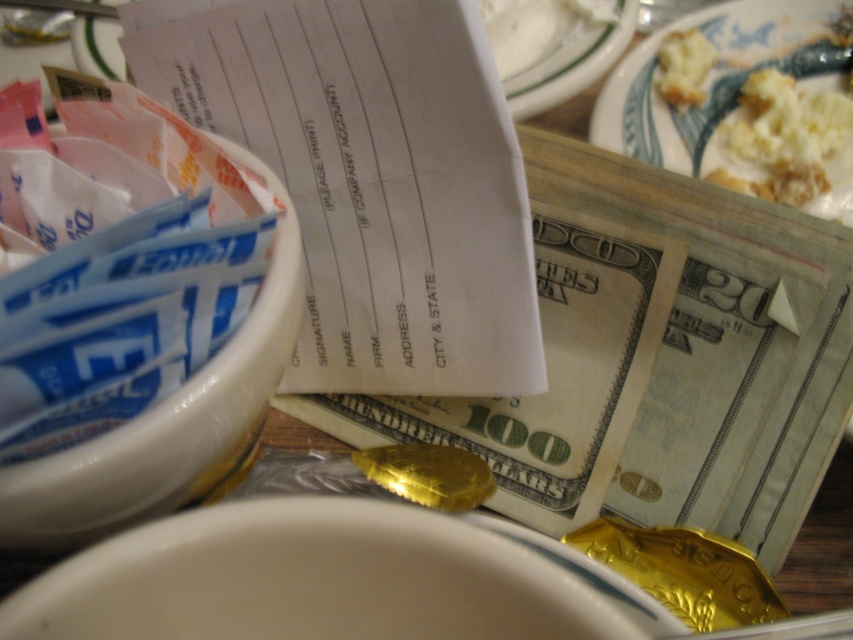
Question: Which point is closer to the camera?

Choices:
 (A) (289, 204)
 (B) (519, 48)

Answer: (A)

Question: Can you confirm if white paper receipt at center is smaller than white glossy bowl at lower center?

Choices:
 (A) no
 (B) yes

Answer: (A)

Question: Does white paper receipt at center lie behind white glossy bowl at lower center?

Choices:
 (A) yes
 (B) no

Answer: (A)

Question: Which object is positioned farthest from the white fluffy mashed potato at upper right?

Choices:
 (A) white paper receipt at center
 (B) golden crumbly bread at upper right

Answer: (A)

Question: Does white fluffy mashed potato at upper right appear on the left side of golden crumbly bread at upper right?

Choices:
 (A) yes
 (B) no

Answer: (B)

Question: Which of the following is the farthest from the observer?

Choices:
 (A) white ceramic plate at upper right
 (B) golden crumbly bread at upper right
 (C) white glossy bowl at lower center

Answer: (B)